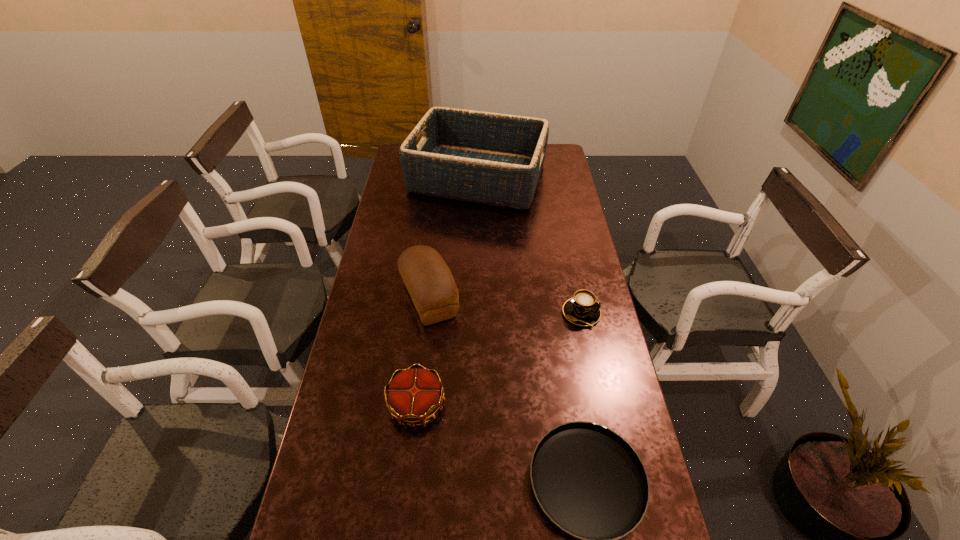
What are the coordinates of `basket situated at the left edge` in the screenshot? It's located at (496, 159).

I want to click on bread that is positioned at the left edge, so click(429, 282).

The height and width of the screenshot is (540, 960). In order to click on crown at the left edge in this screenshot , I will do `click(414, 395)`.

I want to click on basket that is at the right edge, so click(496, 159).

At what (x,y) coordinates should I click in order to perform the action: click on cappuccino at the right edge. Please return your answer as a coordinate pair (x, y). This screenshot has height=540, width=960. Looking at the image, I should click on (582, 309).

Locate an element on the screen. The image size is (960, 540). object present at the far left corner is located at coordinates (496, 159).

The width and height of the screenshot is (960, 540). In order to click on object at the far right corner in this screenshot , I will do `click(496, 159)`.

Locate an element on the screen. The height and width of the screenshot is (540, 960). free space at the left edge of the desktop is located at coordinates (394, 191).

In the image, there is a desktop. Where is `free region at the right edge`? free region at the right edge is located at coordinates (567, 226).

I want to click on blank region between the cappuccino and the bread, so [505, 306].